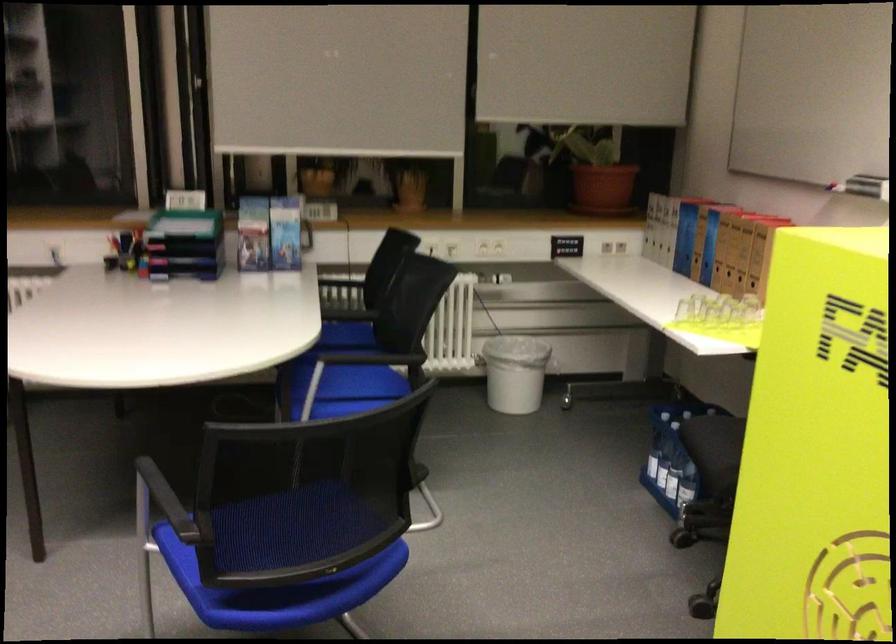
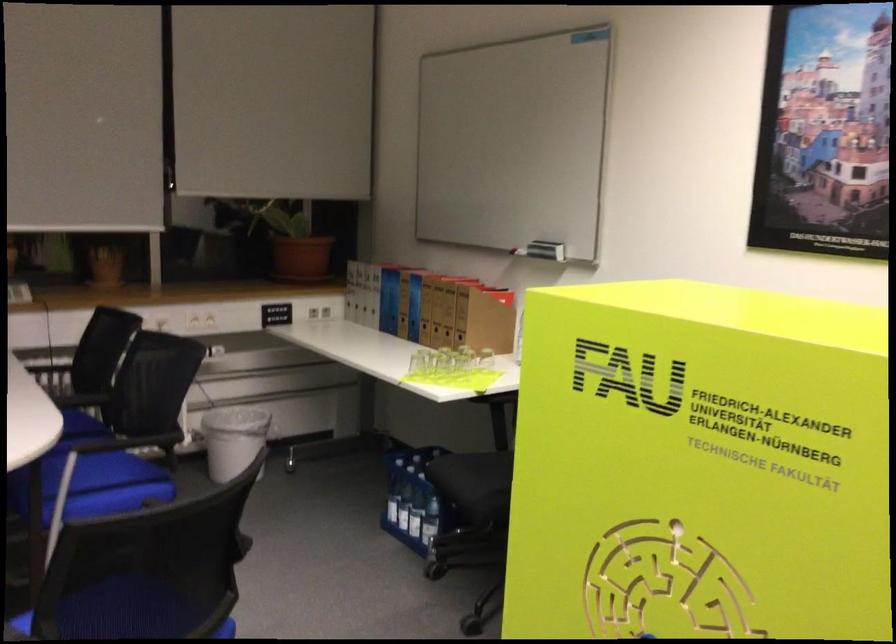
In the second image, find the point that corresponds to (x=507, y=366) in the first image.

(234, 440)